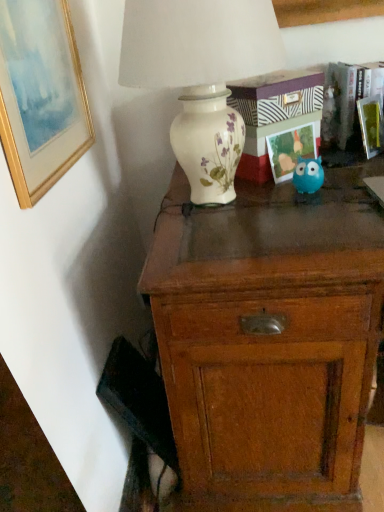
Image resolution: width=384 pixels, height=512 pixels. What are the coordinates of `vacant area that is in front of blue rubber toy at center` in the screenshot? It's located at (319, 211).